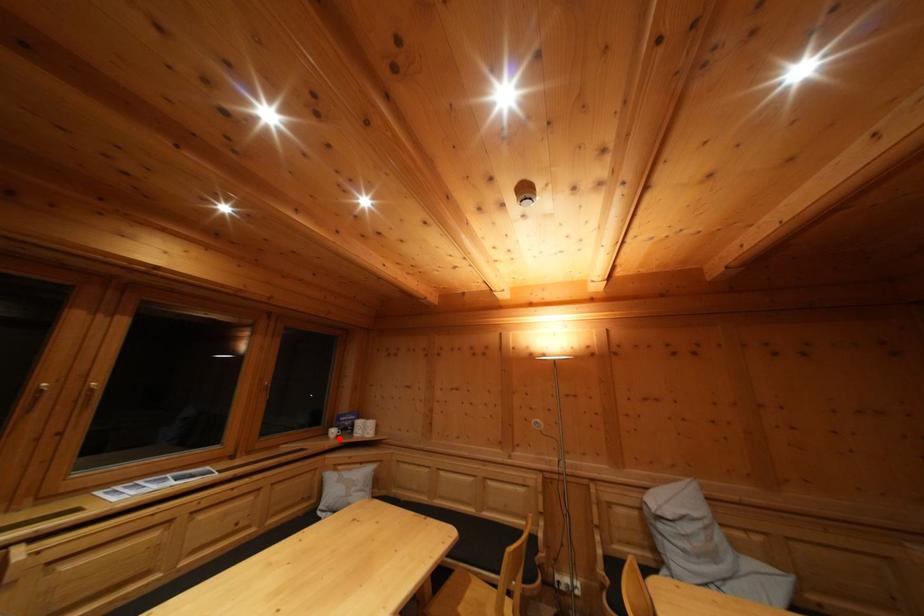
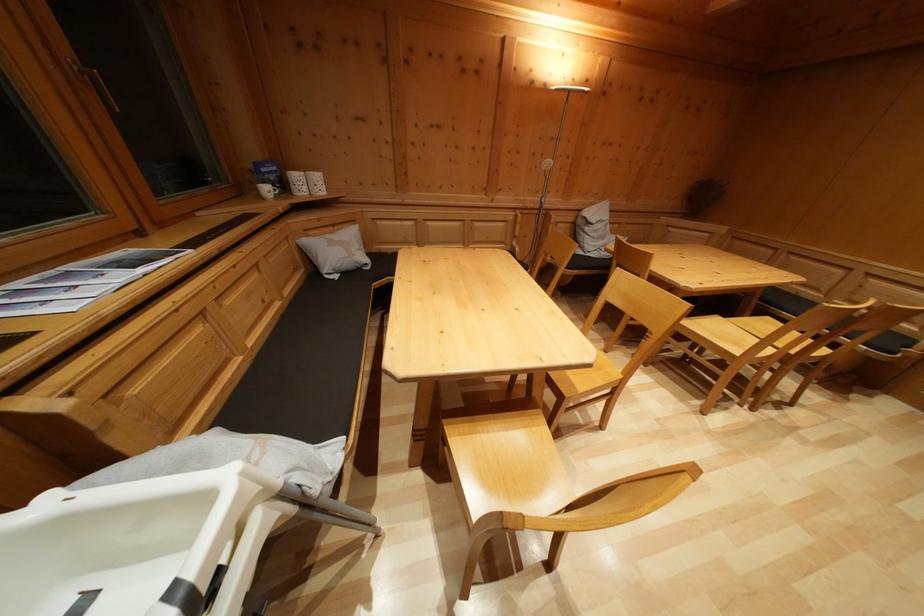
Question: I am providing you with two images of the same scene from different viewpoints. Image1 has a red point marked. In image2, the corresponding 3D location appears at what relative position? Reply with the corresponding letter.

Choices:
 (A) Closer
 (B) Farther

Answer: (A)